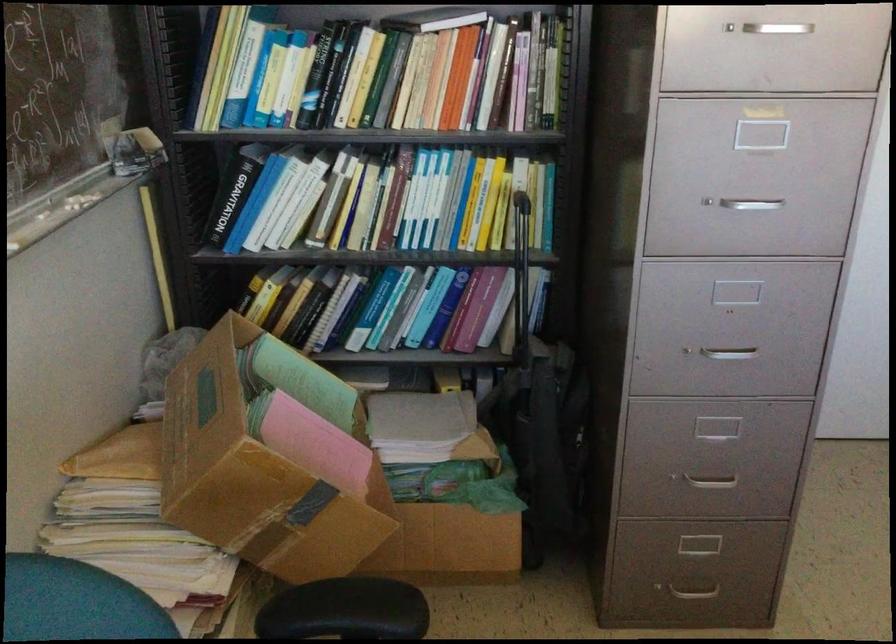
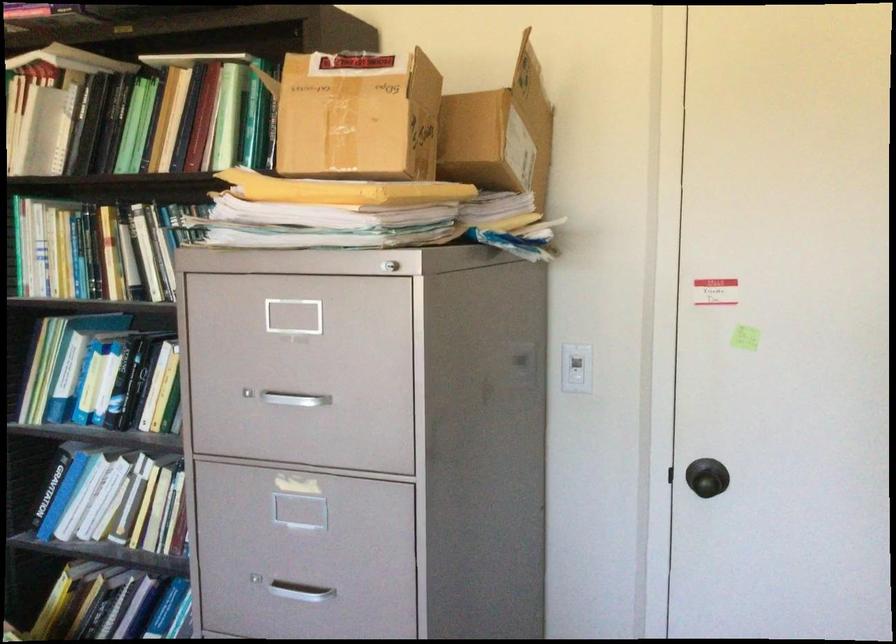
Locate, in the second image, the point that corresponds to (x=311, y=205) in the first image.

(117, 502)